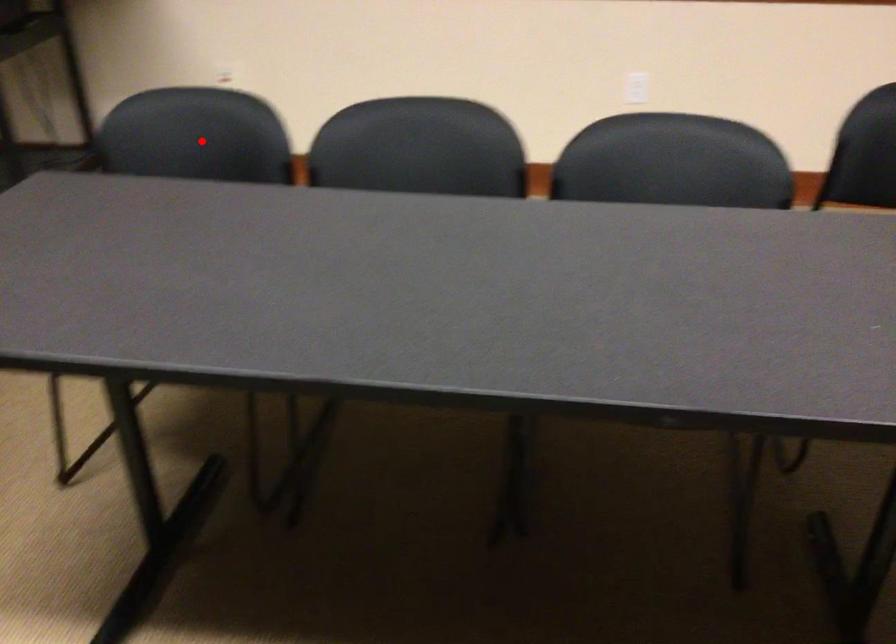
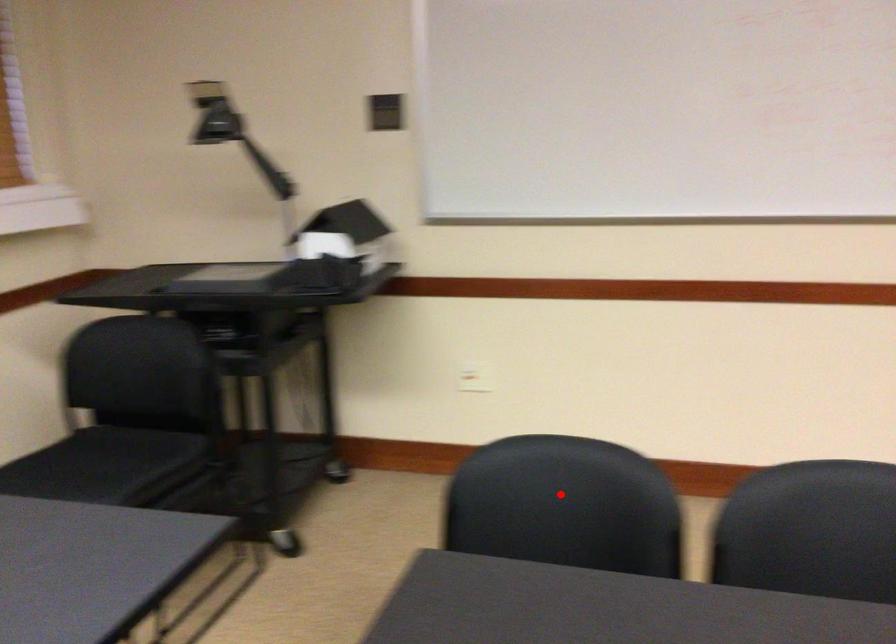
I am providing you with two images of the same scene from different viewpoints. A red point is marked on the first image and another point is marked on the second image. Is the marked point in image1 the same physical position as the marked point in image2?

Yes